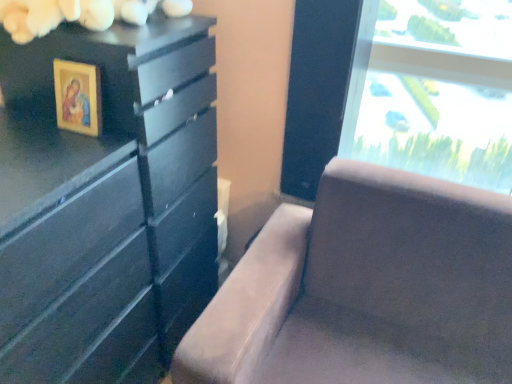
Question: Considering their positions, is wooden framed picture at upper left located in front of or behind suede-like brown couch at center?

Choices:
 (A) front
 (B) behind

Answer: (B)

Question: Is point (61, 82) closer or farther from the camera than point (400, 173)?

Choices:
 (A) closer
 (B) farther

Answer: (A)

Question: Estimate the real-world distances between objects in this image. Which object is closer to the suede-like brown couch at center?

Choices:
 (A) matte black dresser at left
 (B) wooden framed picture at upper left

Answer: (A)

Question: Estimate the real-world distances between objects in this image. Which object is farther from the matte black dresser at left?

Choices:
 (A) suede-like brown couch at center
 (B) wooden framed picture at upper left

Answer: (A)